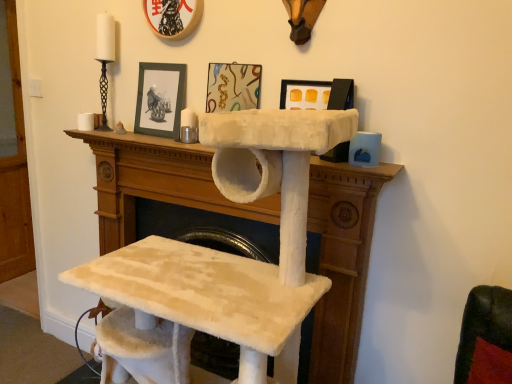
Question: From the image's perspective, is white fluffy cat tree at center on top of black matte picture frame at upper center, positioned as the 3th picture frame in right-to-left order?

Choices:
 (A) no
 (B) yes

Answer: (A)

Question: Are white fluffy cat tree at center and black matte picture frame at upper center, the 1th picture frame from the left, far apart?

Choices:
 (A) no
 (B) yes

Answer: (A)

Question: Does white fluffy cat tree at center have a greater height compared to black matte picture frame at upper center, the 1th picture frame from the left?

Choices:
 (A) yes
 (B) no

Answer: (A)

Question: Would you say white fluffy cat tree at center contains black matte picture frame at upper center, positioned as the 3th picture frame in right-to-left order?

Choices:
 (A) no
 (B) yes

Answer: (A)

Question: Is black matte picture frame at upper center, positioned as the 3th picture frame in right-to-left order, at the back of white fluffy cat tree at center?

Choices:
 (A) yes
 (B) no

Answer: (B)

Question: Based on their sizes in the image, would you say black matte picture frame at upper center, positioned as the 3th picture frame in right-to-left order, is bigger or smaller than white fluffy cat tree at center?

Choices:
 (A) big
 (B) small

Answer: (B)

Question: Is black matte picture frame at upper center, positioned as the 3th picture frame in right-to-left order, to the left or to the right of white fluffy cat tree at center in the image?

Choices:
 (A) left
 (B) right

Answer: (A)

Question: Is black matte picture frame at upper center, the 1th picture frame from the left, inside the boundaries of white fluffy cat tree at center, or outside?

Choices:
 (A) outside
 (B) inside

Answer: (A)

Question: Considering the positions of black matte picture frame at upper center, positioned as the 3th picture frame in right-to-left order, and white fluffy cat tree at center in the image, is black matte picture frame at upper center, positioned as the 3th picture frame in right-to-left order, taller or shorter than white fluffy cat tree at center?

Choices:
 (A) short
 (B) tall

Answer: (A)

Question: Looking at the image, does white fluffy cat tree at center seem bigger or smaller compared to black matte picture frame at upper center, the 1th picture frame from the left?

Choices:
 (A) small
 (B) big

Answer: (B)

Question: Is white fluffy cat tree at center spatially inside black matte picture frame at upper center, the 1th picture frame from the left, or outside of it?

Choices:
 (A) inside
 (B) outside

Answer: (B)

Question: Visually, is white fluffy cat tree at center positioned to the left or to the right of black matte picture frame at upper center, positioned as the 3th picture frame in right-to-left order?

Choices:
 (A) right
 (B) left

Answer: (A)

Question: Is point (120, 135) positioned closer to the camera than point (161, 84)?

Choices:
 (A) closer
 (B) farther

Answer: (B)

Question: From their relative heights in the image, would you say matte plastic picture frame at upper center, which ranks as the second picture frame in right-to-left order, is taller or shorter than matte black picture frame at upper center, which is counted as the first picture frame, starting from the right?

Choices:
 (A) tall
 (B) short

Answer: (A)

Question: Is matte plastic picture frame at upper center, which ranks as the second picture frame in right-to-left order, wider or thinner than matte black picture frame at upper center, which is counted as the first picture frame, starting from the right?

Choices:
 (A) wide
 (B) thin

Answer: (B)